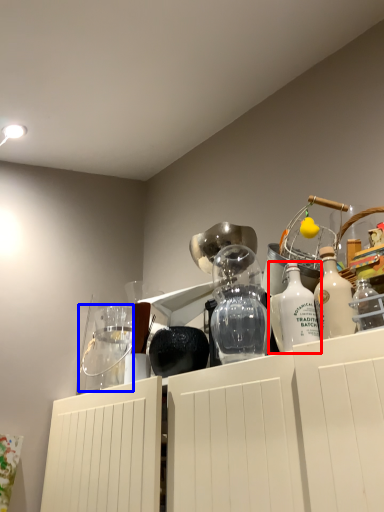
Question: Among these objects, which one is nearest to the camera, bottle (highlighted by a red box) or glass jar (highlighted by a blue box)?

Choices:
 (A) bottle
 (B) glass jar

Answer: (A)